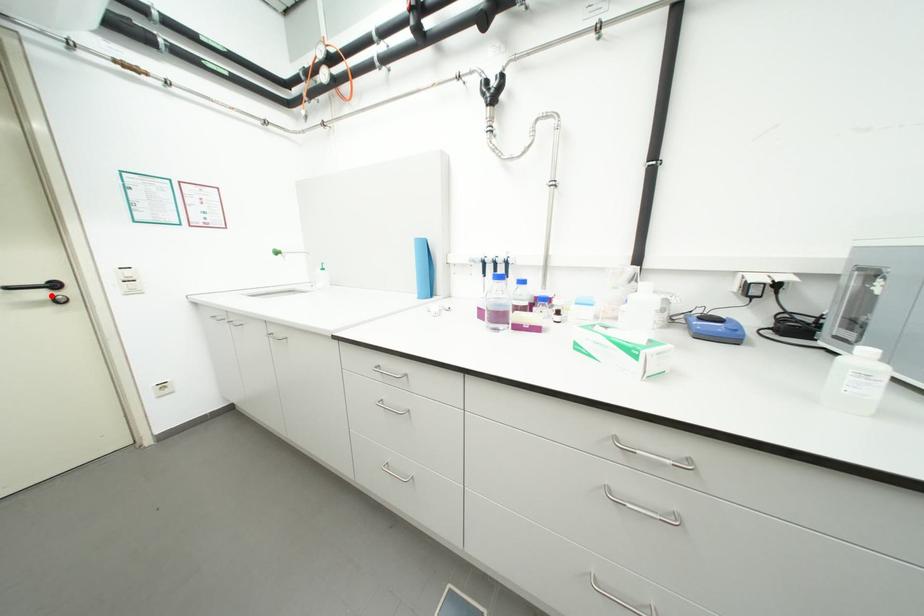
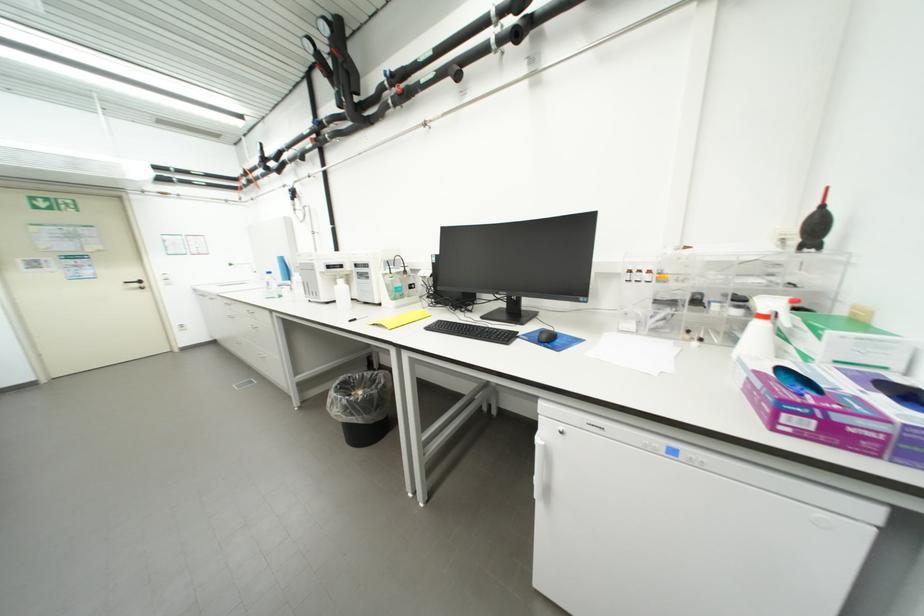
In the second image, find the point that corresponds to the highlighted location in the first image.

(144, 286)